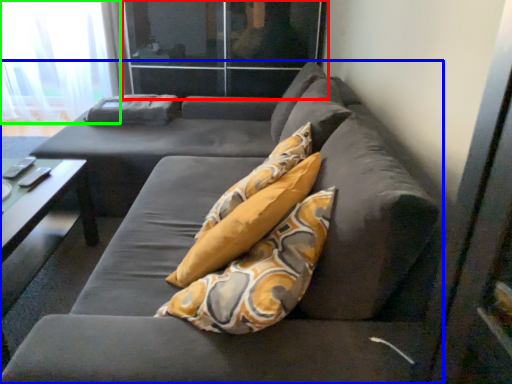
Question: Which object is the closest to the glass door (highlighted by a red box)? Choose among these: studio couch (highlighted by a blue box) or curtain (highlighted by a green box).

Choices:
 (A) studio couch
 (B) curtain

Answer: (B)